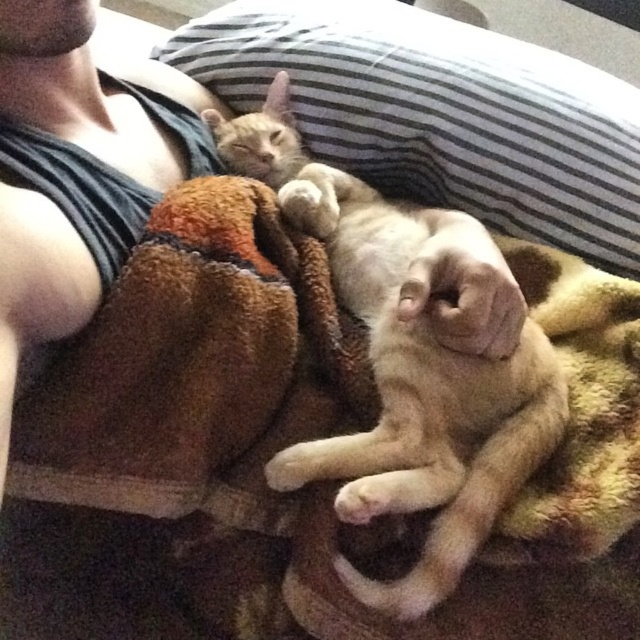
Between striped fabric pillow at upper center and orange fur cat at upper center, which one has more height?

With more height is orange fur cat at upper center.

Which of these two, striped fabric pillow at upper center or orange fur cat at upper center, stands shorter?

Standing shorter between the two is striped fabric pillow at upper center.

This screenshot has width=640, height=640. What are the coordinates of `striped fabric pillow at upper center` in the screenshot? It's located at (440, 113).

Does point (144, 241) come farther from viewer compared to point (484, 29)?

No.

Does brown fuzzy blanket at center appear on the right side of striped fabric pillow at upper center?

Incorrect, brown fuzzy blanket at center is not on the right side of striped fabric pillow at upper center.

Is point (246, 481) positioned behind point (264, 1)?

No, it is in front of (264, 1).

Where is `brown fuzzy blanket at center`? Image resolution: width=640 pixels, height=640 pixels. brown fuzzy blanket at center is located at coordinates (234, 458).

Which is more to the left, brown fuzzy blanket at center or orange fur cat at upper center?

brown fuzzy blanket at center

Between brown fuzzy blanket at center and orange fur cat at upper center, which one is positioned higher?

Positioned higher is orange fur cat at upper center.

Is point (19, 557) farther from viewer compared to point (483, 358)?

No, (19, 557) is closer to viewer.

At what (x,y) coordinates should I click in order to perform the action: click on brown fuzzy blanket at center. Please return your answer as a coordinate pair (x, y). The image size is (640, 640). Looking at the image, I should click on (234, 458).